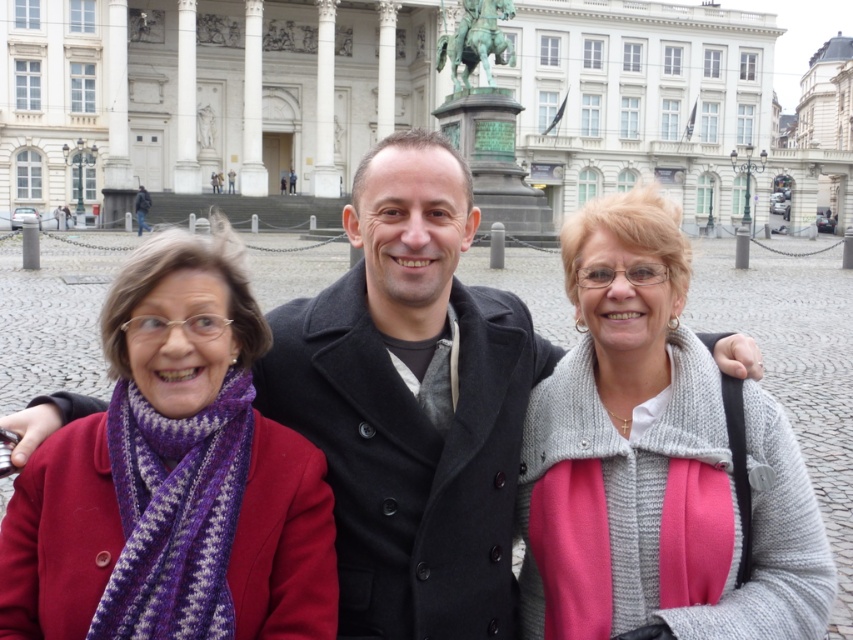
Which is more to the right, purple knitted scarf at center or green patina bronze horseman at upper center?

green patina bronze horseman at upper center

Is point (152, 403) in front of point (503, 49)?

Yes, point (152, 403) is closer to viewer.

Which is in front, point (274, 604) or point (490, 51)?

Point (274, 604)

This screenshot has width=853, height=640. In order to click on purple knitted scarf at center in this screenshot , I will do `click(173, 477)`.

Between green patina bronze horseman at upper center and dark gray coat at center, which one has more height?

With more height is green patina bronze horseman at upper center.

Is green patina bronze horseman at upper center taller than dark gray coat at center?

Yes.

Is point (477, 6) farther from viewer compared to point (138, 195)?

No, (477, 6) is closer to viewer.

Find the location of a particular element. The image size is (853, 640). green patina bronze horseman at upper center is located at coordinates (476, 40).

Is knitted gray sweater at center positioned behind dark gray coat at center?

No, knitted gray sweater at center is closer to the viewer.

The image size is (853, 640). In order to click on knitted gray sweater at center in this screenshot , I will do `click(654, 461)`.